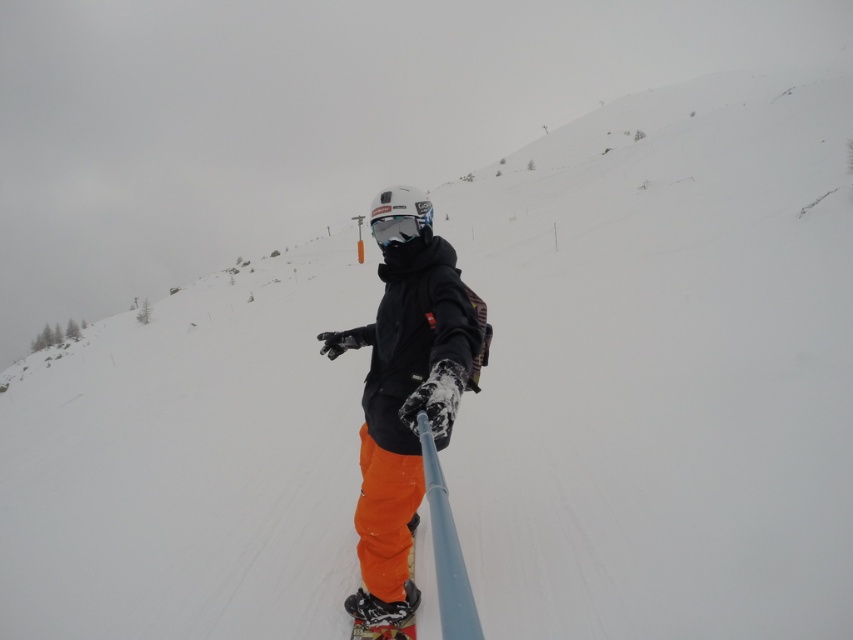
Is point (389, 291) positioned in front of point (405, 627)?

No, it is not.

Is orange snow pants at center further to camera compared to orange matte snowboard at lower center?

No, orange snow pants at center is closer to the viewer.

Is point (390, 246) farther from camera compared to point (376, 636)?

No, it is in front of (376, 636).

You are a GUI agent. You are given a task and a screenshot of the screen. Output one action in this format:
    pyautogui.click(x=<x>, y=<y>)
    Task: Click on the orange snow pants at center
    
    Given the screenshot: What is the action you would take?
    pyautogui.click(x=405, y=406)

Does transparent plastic goggles at center appear under orange matte snowboard at lower center?

Actually, transparent plastic goggles at center is above orange matte snowboard at lower center.

You are a GUI agent. You are given a task and a screenshot of the screen. Output one action in this format:
    pyautogui.click(x=<x>, y=<y>)
    Task: Click on the transparent plastic goggles at center
    This screenshot has width=853, height=640.
    Given the screenshot: What is the action you would take?
    pyautogui.click(x=399, y=227)

Does orange snow pants at center have a larger size compared to transparent plastic goggles at center?

Indeed, orange snow pants at center has a larger size compared to transparent plastic goggles at center.

Is point (373, 428) positioned behind point (381, 248)?

No, it is in front of (381, 248).

Is point (456, 397) positioned after point (408, 230)?

No, it is in front of (408, 230).

The image size is (853, 640). Find the location of `orange snow pants at center`. orange snow pants at center is located at coordinates (405, 406).